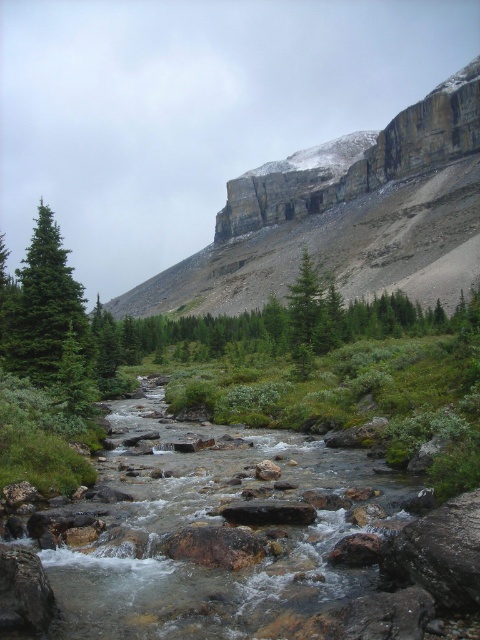
Between gray rocky cliff at upper right and green matte evergreen tree at left, which one is positioned lower?

green matte evergreen tree at left is lower down.

Is gray rocky cliff at upper right to the right of green matte evergreen tree at left from the viewer's perspective?

Yes, gray rocky cliff at upper right is to the right of green matte evergreen tree at left.

Is point (450, 97) less distant than point (40, 221)?

No, it is behind (40, 221).

Locate an element on the screen. The width and height of the screenshot is (480, 640). gray rocky cliff at upper right is located at coordinates (345, 216).

Is point (464, 227) closer to camera compared to point (302, 284)?

No, (464, 227) is further to viewer.

Is gray rocky cliff at upper right thinner than green matte evergreen tree at center?

Incorrect, gray rocky cliff at upper right's width is not less than green matte evergreen tree at center's.

Which is in front, point (454, 220) or point (314, 340)?

Point (314, 340) is in front.

I want to click on gray rocky cliff at upper right, so click(345, 216).

Does green matte evergreen tree at left have a greater height compared to green matte evergreen tree at center?

Incorrect, green matte evergreen tree at left's height is not larger of green matte evergreen tree at center's.

Is green matte evergreen tree at left above green matte evergreen tree at center?

No.

Measure the distance between point (x=12, y=320) and camera.

They are 54.84 meters apart.

This screenshot has height=640, width=480. Identify the location of green matte evergreen tree at left. [45, 307].